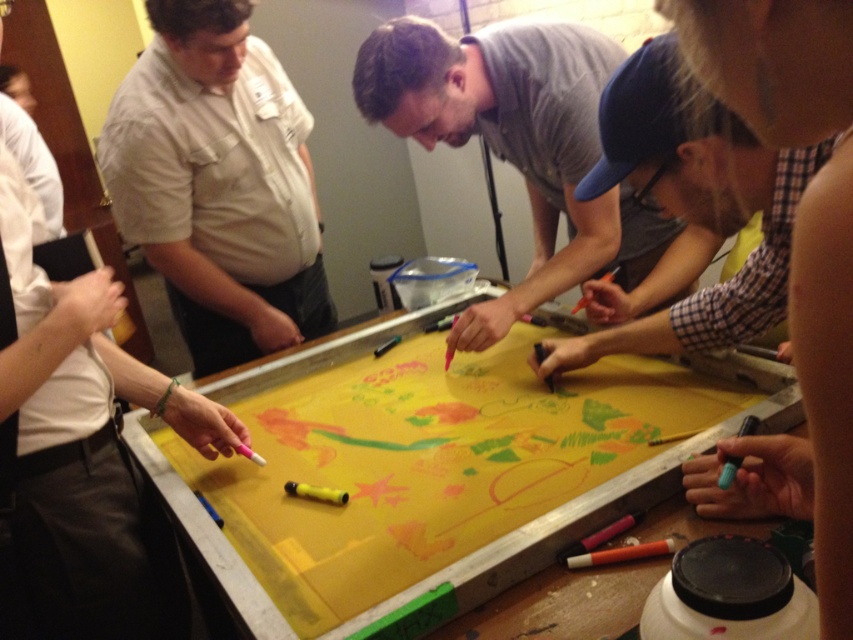
You are a participant in the collaborative activity and need to reach for the orange matte crayon at lower center without disturbing the matte khaki shirt at left. Can you do so based on their heights?

The matte khaki shirt at left is taller than the orange matte crayon at lower center. Since the shirt is taller, you can likely reach the crayon without disturbing the shirt by bending or moving around it.

You are standing in front of the collaborative artwork. Where is the matte khaki shirt at left located in the image?

The matte khaki shirt at left is located at point 0.287 on the x axis and 0.257 on the y axis.